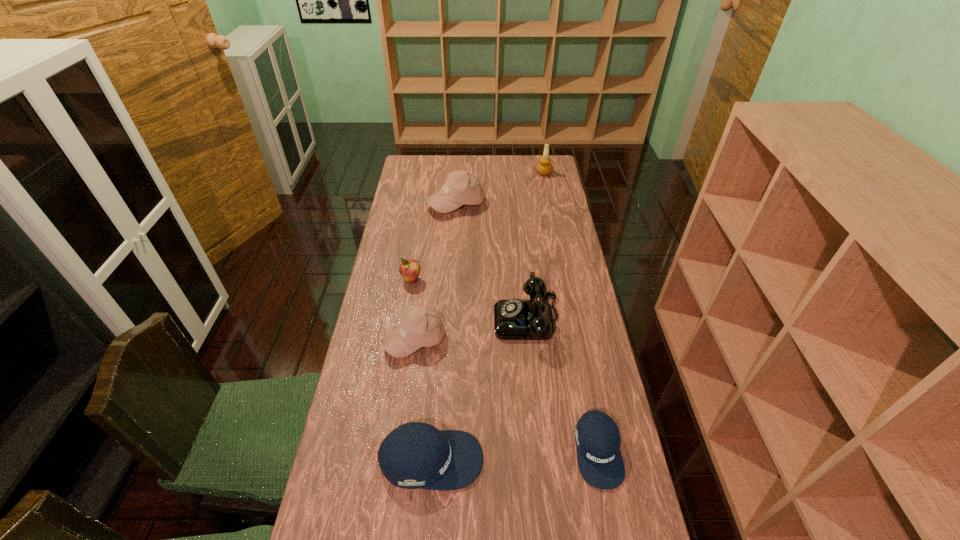
Identify the location of object that is at the far edge. (544, 167).

Find the location of a particular element. apple at the left edge is located at coordinates (409, 269).

Locate an element on the screen. The image size is (960, 540). candle_holder that is at the right edge is located at coordinates (544, 167).

Where is `telephone present at the right edge`? telephone present at the right edge is located at coordinates (514, 319).

This screenshot has width=960, height=540. What are the coordinates of `baseball cap that is at the right edge` in the screenshot? It's located at (597, 437).

Where is `object that is at the far right corner`? object that is at the far right corner is located at coordinates (544, 167).

In order to click on vacant region at the far edge in this screenshot , I will do `click(478, 170)`.

Where is `free space at the left edge`? Image resolution: width=960 pixels, height=540 pixels. free space at the left edge is located at coordinates (369, 498).

You are a GUI agent. You are given a task and a screenshot of the screen. Output one action in this format:
    pyautogui.click(x=<x>, y=<y>)
    Task: Click on the vacant space at the right edge
    
    Given the screenshot: What is the action you would take?
    pyautogui.click(x=565, y=398)

In order to click on vacant space at the far left corner of the desktop in this screenshot , I will do `click(404, 165)`.